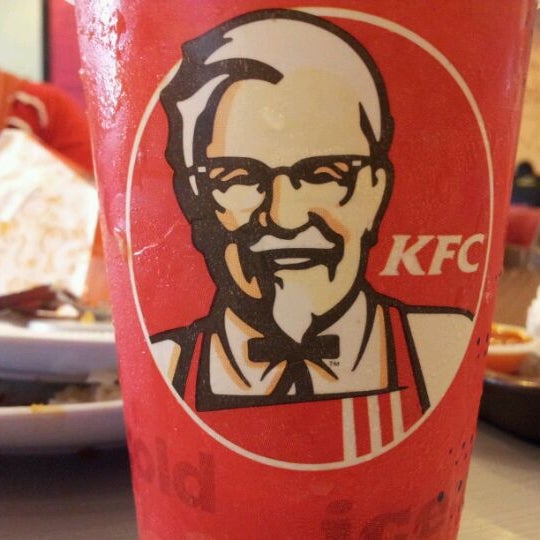
Locate an element on the screen. The image size is (540, 540). wall is located at coordinates (54, 77).